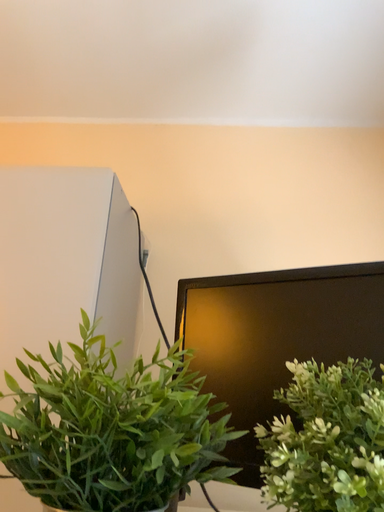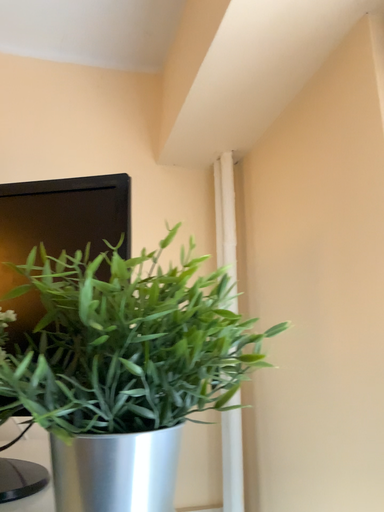
Question: How did the camera likely rotate when shooting the video?

Choices:
 (A) rotated left
 (B) rotated right

Answer: (B)